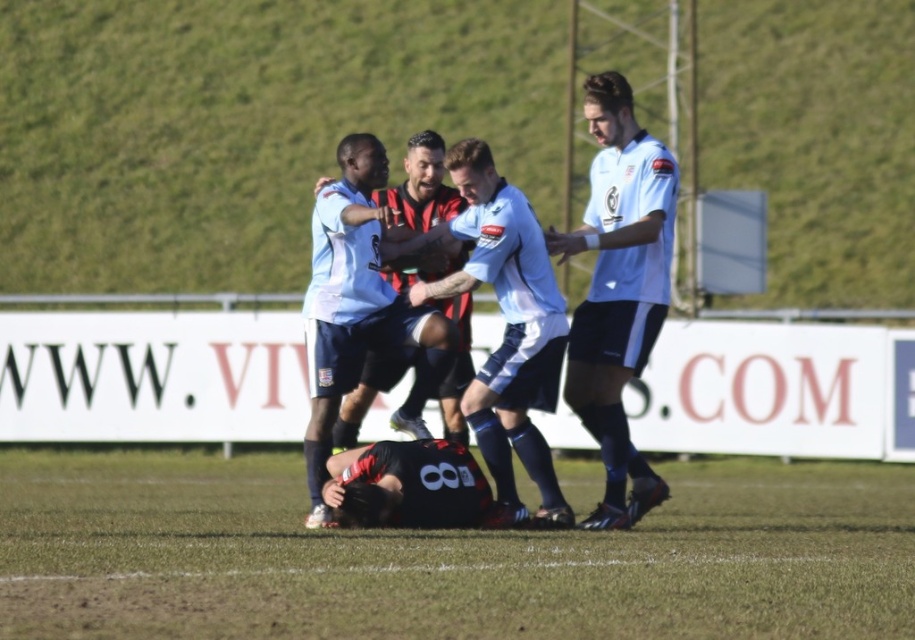
What is the coordinate of the green grass football field at lower center?

The green grass football field at lower center is located at point (444,556).

You are a soccer referee standing at the center of the field. You need to determine which of the two points, point (628, 336) or point (440, 177), is closer to you. Which one is closer?

Point (628, 336) is closer to the viewer than point (440, 177), so the referee should choose point (628, 336) as the closer one.